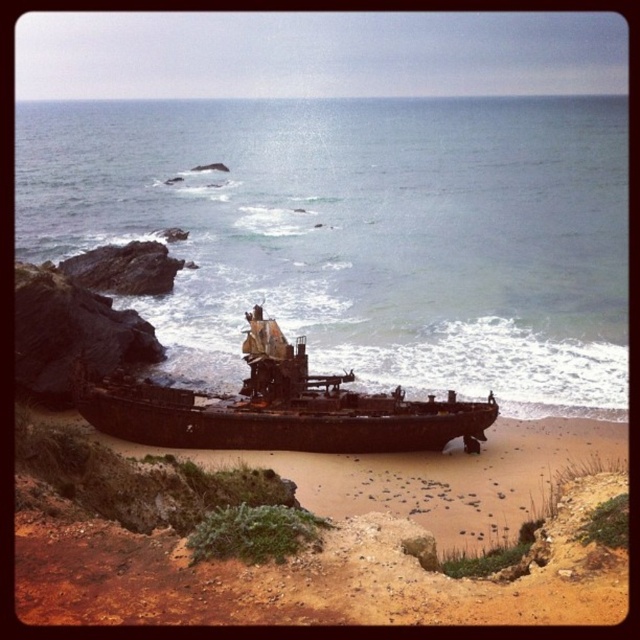
The width and height of the screenshot is (640, 640). In order to click on clear blue water at lower center in this screenshot , I will do `click(362, 234)`.

Can you confirm if clear blue water at lower center is wider than rusty metal pirate ship at center?

Yes.

Is point (522, 205) positioned before point (269, 412)?

No, (522, 205) is further to viewer.

Where is `clear blue water at lower center`? The height and width of the screenshot is (640, 640). clear blue water at lower center is located at coordinates (362, 234).